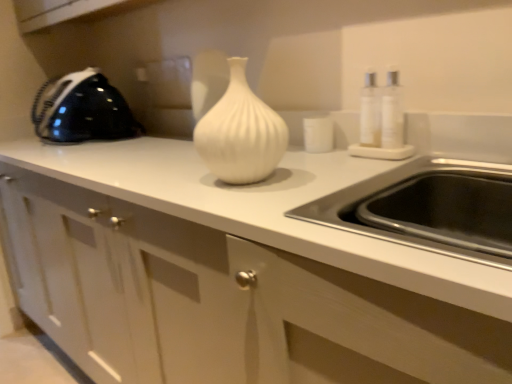
Question: Can you confirm if white glossy cabinet at center is positioned to the right of white glossy vase at center?

Choices:
 (A) no
 (B) yes

Answer: (A)

Question: Is white glossy cabinet at center far from white glossy vase at center?

Choices:
 (A) no
 (B) yes

Answer: (A)

Question: From the image's perspective, is white glossy cabinet at center on top of white glossy vase at center?

Choices:
 (A) yes
 (B) no

Answer: (B)

Question: From a real-world perspective, is white glossy cabinet at center located beneath white glossy vase at center?

Choices:
 (A) yes
 (B) no

Answer: (A)

Question: Is white glossy cabinet at center turned away from white glossy vase at center?

Choices:
 (A) no
 (B) yes

Answer: (A)

Question: Is point (206, 120) closer or farther from the camera than point (108, 130)?

Choices:
 (A) closer
 (B) farther

Answer: (A)

Question: In terms of height, does white glossy vase at center look taller or shorter compared to black glossy iron at left?

Choices:
 (A) tall
 (B) short

Answer: (B)

Question: Do you think white glossy vase at center is within black glossy iron at left, or outside of it?

Choices:
 (A) inside
 (B) outside

Answer: (B)

Question: From the image's perspective, is white glossy vase at center above or below black glossy iron at left?

Choices:
 (A) above
 (B) below

Answer: (B)

Question: Looking at their shapes, would you say white glossy vase at center is wider or thinner than white glossy cabinet at center?

Choices:
 (A) wide
 (B) thin

Answer: (B)

Question: From their relative heights in the image, would you say white glossy vase at center is taller or shorter than white glossy cabinet at center?

Choices:
 (A) tall
 (B) short

Answer: (B)

Question: Would you say white glossy vase at center is to the left or to the right of white glossy cabinet at center in the picture?

Choices:
 (A) right
 (B) left

Answer: (A)

Question: Considering their positions, is white glossy vase at center located in front of or behind white glossy cabinet at center?

Choices:
 (A) behind
 (B) front

Answer: (A)

Question: From a real-world perspective, is black glossy iron at left physically located above or below white glossy vase at center?

Choices:
 (A) below
 (B) above

Answer: (B)

Question: Does point (73, 86) appear closer or farther from the camera than point (224, 102)?

Choices:
 (A) farther
 (B) closer

Answer: (A)